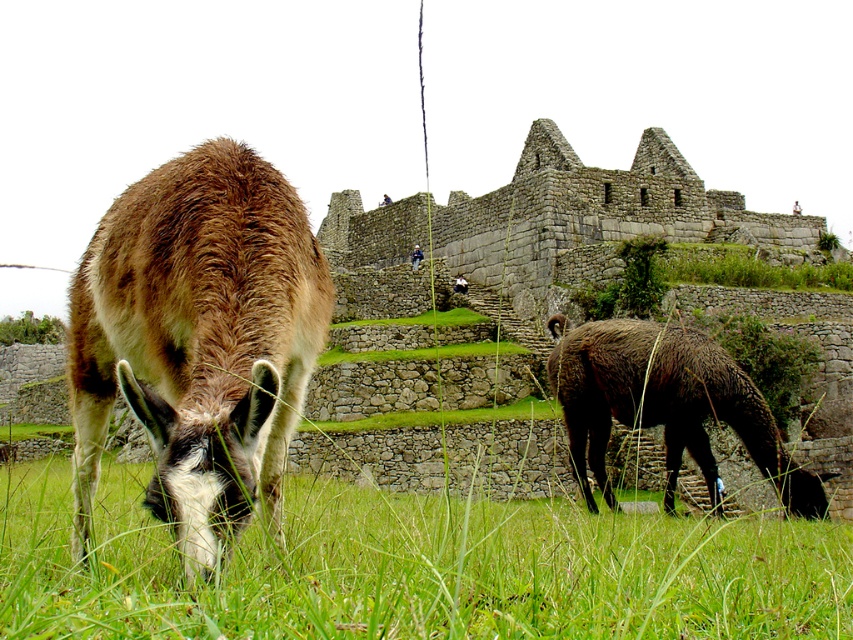
Is brown woolen llama at lower left closer to the viewer compared to dark brown woolen llama at right?

Yes, brown woolen llama at lower left is in front of dark brown woolen llama at right.

Is the position of brown woolen llama at lower left more distant than that of dark brown woolen llama at right?

No, it is not.

Find the location of a particular element. The width and height of the screenshot is (853, 640). brown woolen llama at lower left is located at coordinates (415, 568).

You are a GUI agent. You are given a task and a screenshot of the screen. Output one action in this format:
    pyautogui.click(x=<x>, y=<y>)
    Task: Click on the brown fuzzy llama at left
    The width and height of the screenshot is (853, 640).
    Given the screenshot: What is the action you would take?
    pyautogui.click(x=198, y=340)

Is brown fuzzy llama at left thinner than dark brown woolen llama at right?

Yes.

Where is `brown fuzzy llama at left`? Image resolution: width=853 pixels, height=640 pixels. brown fuzzy llama at left is located at coordinates (198, 340).

Which of these two, brown woolen llama at lower left or brown fuzzy llama at left, stands taller?

Standing taller between the two is brown fuzzy llama at left.

Which is more to the right, brown woolen llama at lower left or brown fuzzy llama at left?

From the viewer's perspective, brown woolen llama at lower left appears more on the right side.

Which is in front, point (294, 621) or point (181, 310)?

Positioned in front is point (294, 621).

You are a GUI agent. You are given a task and a screenshot of the screen. Output one action in this format:
    pyautogui.click(x=<x>, y=<y>)
    Task: Click on the brown woolen llama at lower left
    Image resolution: width=853 pixels, height=640 pixels.
    Given the screenshot: What is the action you would take?
    pyautogui.click(x=415, y=568)